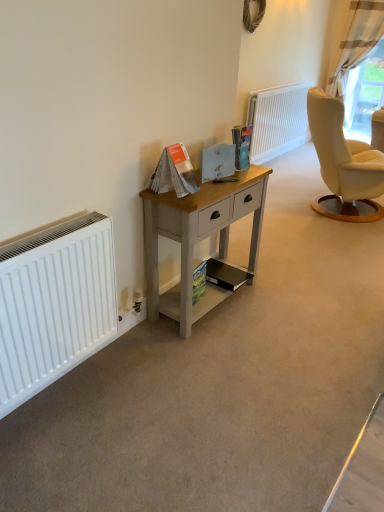
Find the location of a particular element. This screenshot has height=512, width=384. space that is in front of light gray wood desk at center is located at coordinates (213, 357).